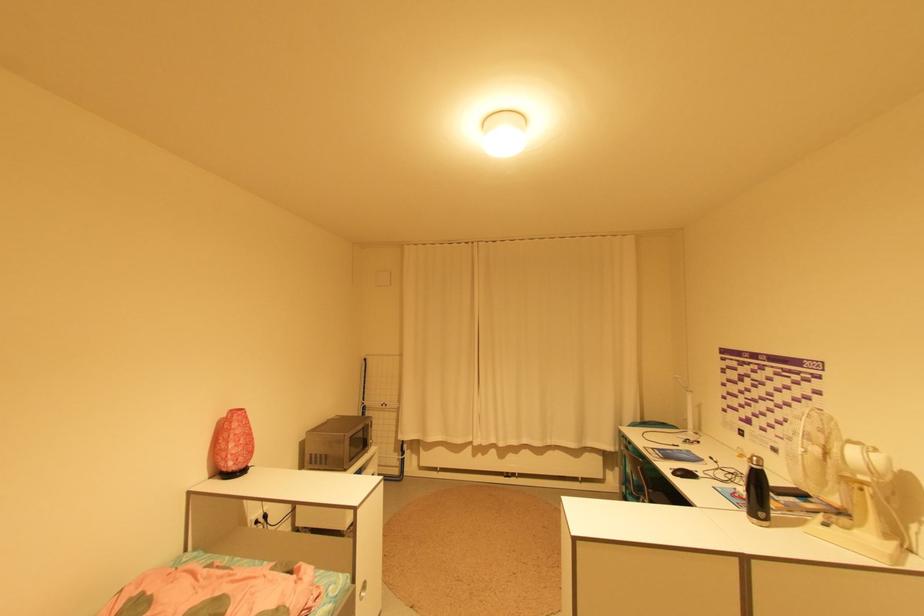
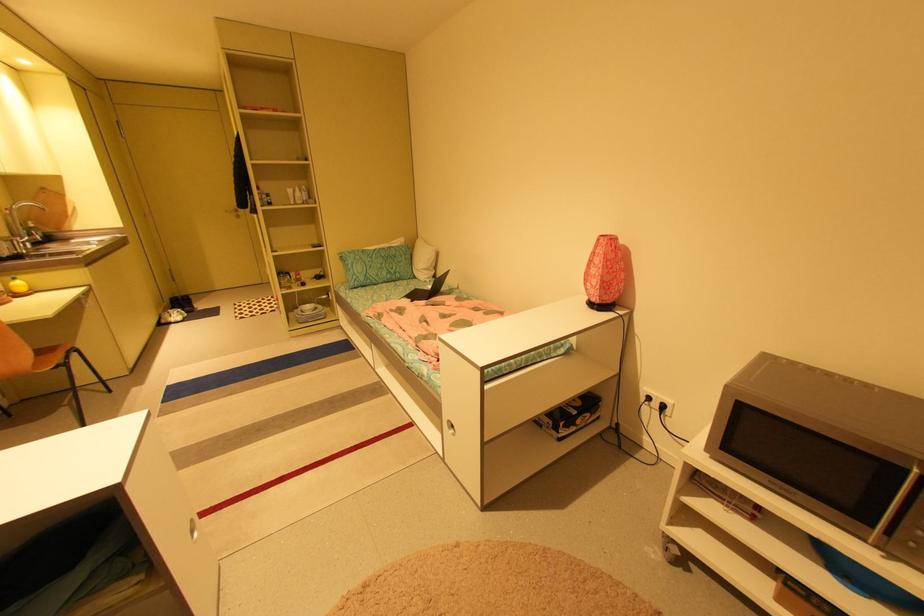
Locate, in the second image, the point that corresponds to the point at 237,411 in the first image.

(608, 236)